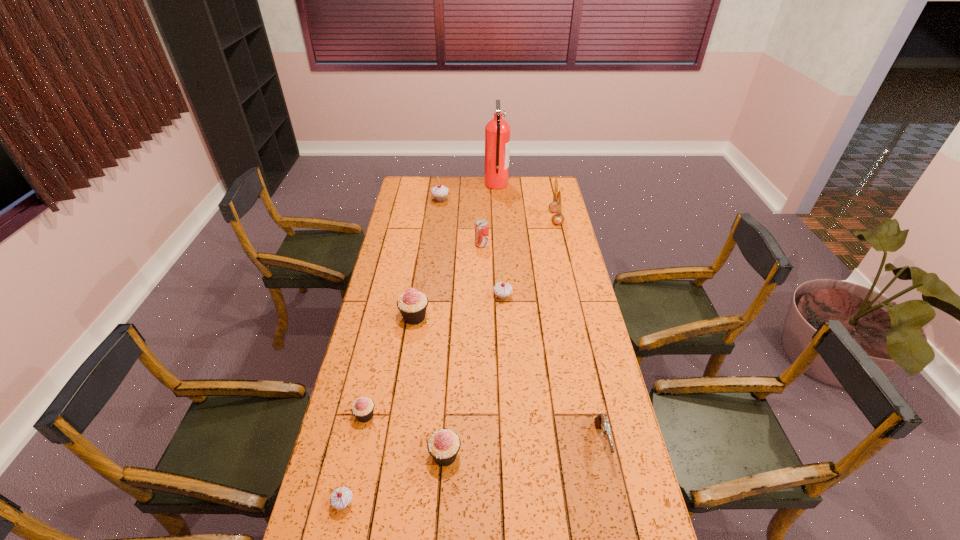
Identify the location of fire extinguisher. (497, 132).

At what (x,y) coordinates should I click in order to perform the action: click on the tallest object. Please return your answer as a coordinate pair (x, y). This screenshot has height=540, width=960. Looking at the image, I should click on (497, 132).

The width and height of the screenshot is (960, 540). What are the coordinates of `the third farthest object` in the screenshot? It's located at (556, 206).

The width and height of the screenshot is (960, 540). I want to click on earphone, so click(x=556, y=206).

In order to click on the farthest cupcake in this screenshot , I will do `click(439, 192)`.

I want to click on the biggest gray cupcake, so click(x=439, y=192).

I want to click on the fourth nearest cupcake, so click(412, 304).

Find the location of a particular element. the second pink cupcake from right to left is located at coordinates (412, 304).

Find the location of `the seventh nearest object`. the seventh nearest object is located at coordinates (481, 226).

Where is `pink soda can`? pink soda can is located at coordinates (481, 226).